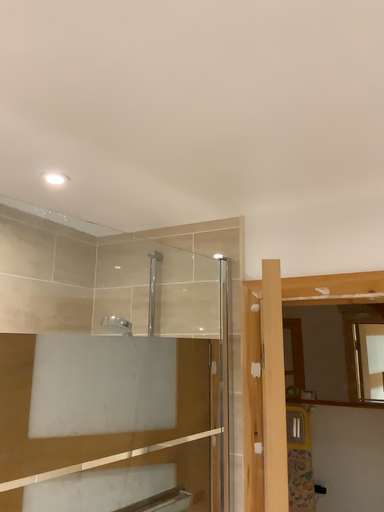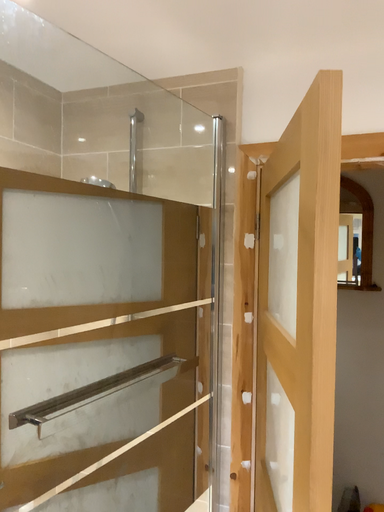
Question: Which way did the camera rotate in the video?

Choices:
 (A) rotated downward
 (B) rotated upward

Answer: (A)